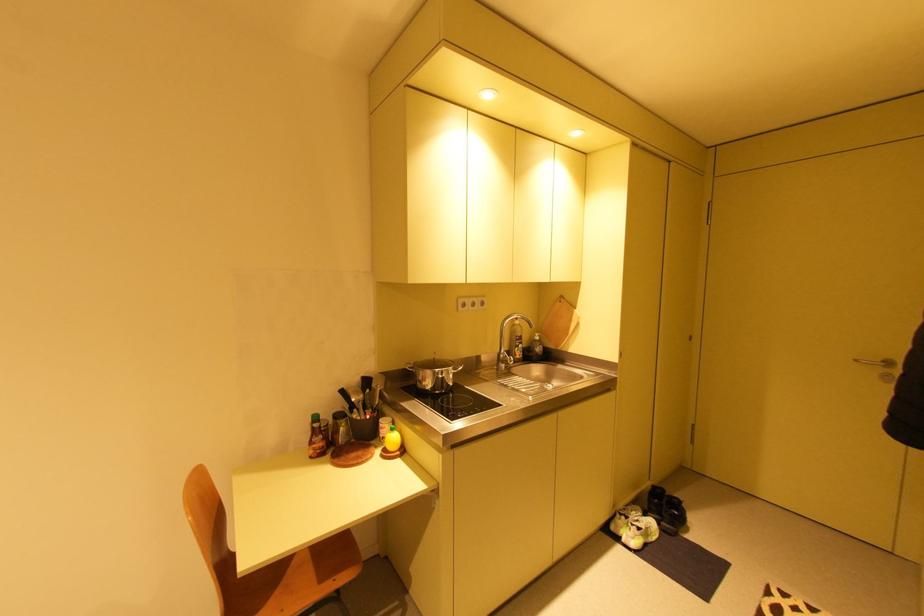
The image size is (924, 616). What do you see at coordinates (877, 362) in the screenshot?
I see `a silver door handle` at bounding box center [877, 362].